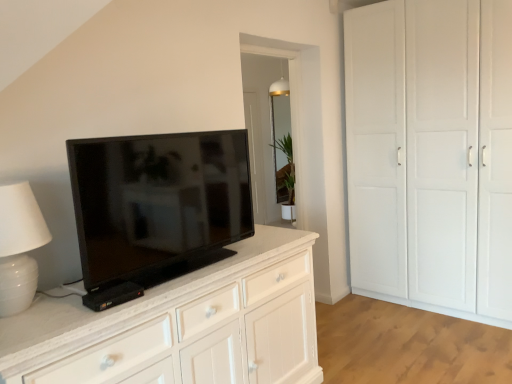
Question: Is green matte plant at center inside white matte cupboard at right?

Choices:
 (A) no
 (B) yes

Answer: (A)

Question: Considering the relative positions of white matte cupboard at right and green matte plant at center in the image provided, is white matte cupboard at right in front of green matte plant at center?

Choices:
 (A) yes
 (B) no

Answer: (A)

Question: From a real-world perspective, is white matte cupboard at right under green matte plant at center?

Choices:
 (A) no
 (B) yes

Answer: (A)

Question: Considering the relative positions of white matte cupboard at right and green matte plant at center in the image provided, is white matte cupboard at right to the left of green matte plant at center from the viewer's perspective?

Choices:
 (A) no
 (B) yes

Answer: (A)

Question: Is white matte cupboard at right not within green matte plant at center?

Choices:
 (A) no
 (B) yes

Answer: (B)

Question: From the image's perspective, would you say white matte cupboard at right is shown under green matte plant at center?

Choices:
 (A) no
 (B) yes

Answer: (A)

Question: From a real-world perspective, is white ceramic table lamp at left positioned over black glossy tv at center based on gravity?

Choices:
 (A) yes
 (B) no

Answer: (B)

Question: Can you confirm if white ceramic table lamp at left is thinner than black glossy tv at center?

Choices:
 (A) yes
 (B) no

Answer: (B)

Question: Is white ceramic table lamp at left outside black glossy tv at center?

Choices:
 (A) no
 (B) yes

Answer: (B)

Question: From the image's perspective, does white ceramic table lamp at left appear lower than black glossy tv at center?

Choices:
 (A) yes
 (B) no

Answer: (A)

Question: Can you see white ceramic table lamp at left touching black glossy tv at center?

Choices:
 (A) no
 (B) yes

Answer: (A)

Question: Is white ceramic table lamp at left to the left of black glossy tv at center from the viewer's perspective?

Choices:
 (A) yes
 (B) no

Answer: (A)

Question: Is black glossy tv at center behind white matte cupboard at right?

Choices:
 (A) no
 (B) yes

Answer: (A)